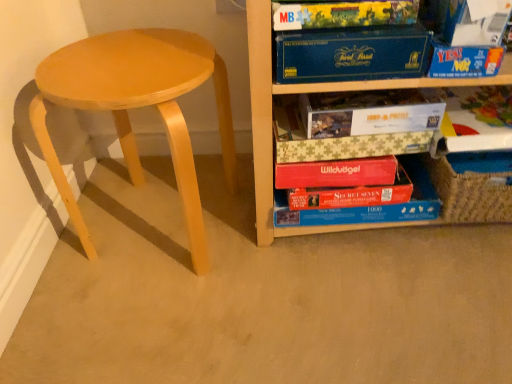
Question: Is light wood stool at left bigger or smaller than yellow cardboard puzzle box at upper center, which is the 3th paperback book in bottom-to-top order?

Choices:
 (A) small
 (B) big

Answer: (B)

Question: Is light wood stool at left taller or shorter than yellow cardboard puzzle box at upper center, which is the 3th paperback book in bottom-to-top order?

Choices:
 (A) tall
 (B) short

Answer: (A)

Question: Which of these objects is positioned closest to the wooden puzzle box at right?

Choices:
 (A) yellow cardboard puzzle box at upper center, which ranks as the 2th paperback book in top-to-bottom order
 (B) red cardboard puzzle box at lower center, the second book positioned from the right
 (C) light wood stool at left
 (D) matte cardboard book at upper right, the second book viewed from the left
 (E) white cardboard puzzle box at center, the fourth paperback book in the top-to-bottom sequence

Answer: (E)

Question: Which object is positioned farthest from the yellow cardboard puzzle box at upper center, which ranks as the 2th paperback book in top-to-bottom order?

Choices:
 (A) blue cardboard box at upper right, which ranks as the second paperback book in bottom-to-top order
 (B) white paper at upper right, which is the first paperback book in top-to-bottom order
 (C) red cardboard puzzle box at lower center, marked as the second book in a top-to-bottom arrangement
 (D) matte cardboard book at upper right, the 1th book viewed from the top
 (E) wooden puzzle box at right

Answer: (C)